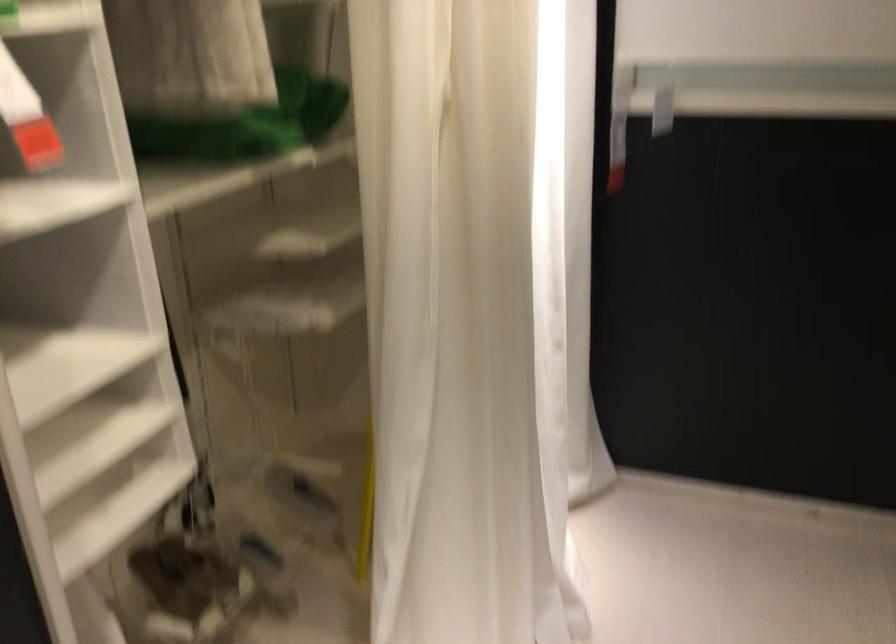
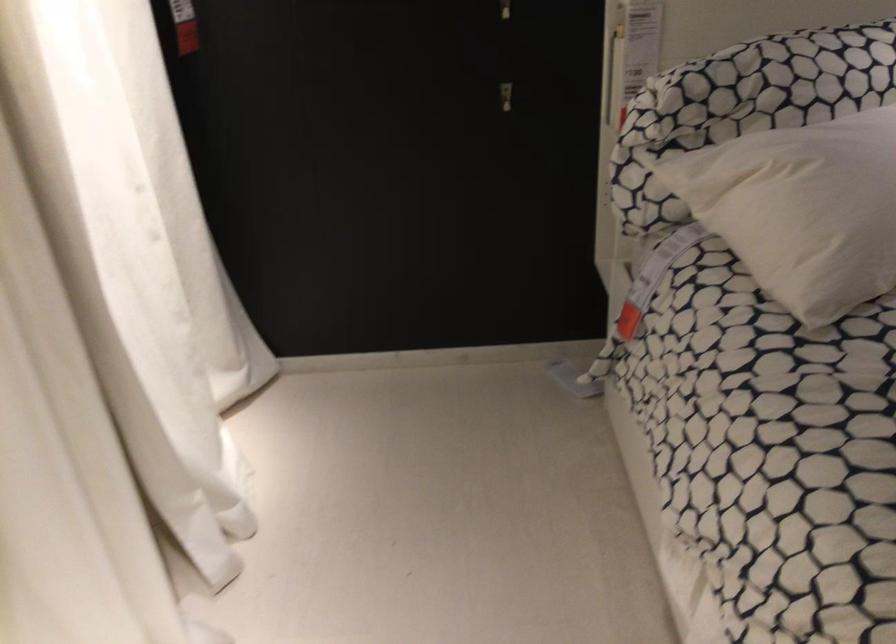
Question: The camera is either moving clockwise (left) or counter-clockwise (right) around the object. The first image is from the beginning of the video and the second image is from the end. Is the camera moving left or right when shooting the video?

Choices:
 (A) Left
 (B) Right

Answer: (A)